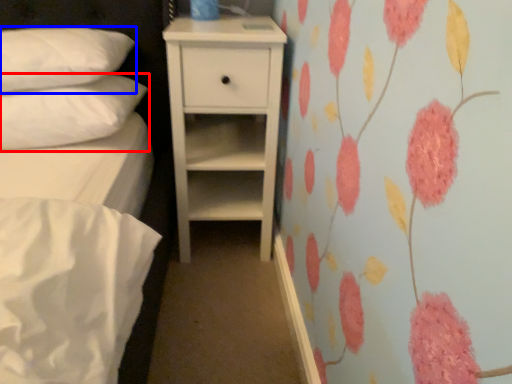
Question: Which of the following is the closest to the observer, pillow (highlighted by a red box) or pillow (highlighted by a blue box)?

Choices:
 (A) pillow
 (B) pillow

Answer: (B)